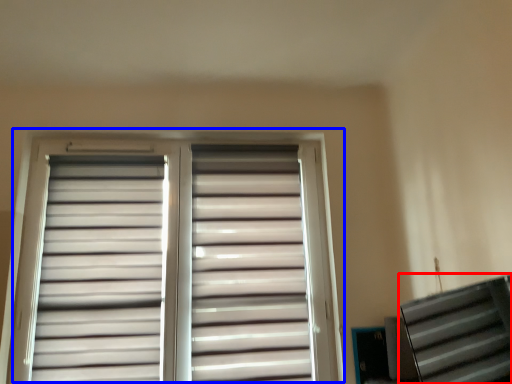
Question: Which object is further to the camera taking this photo, stairwell (highlighted by a red box) or window (highlighted by a blue box)?

Choices:
 (A) stairwell
 (B) window

Answer: (B)